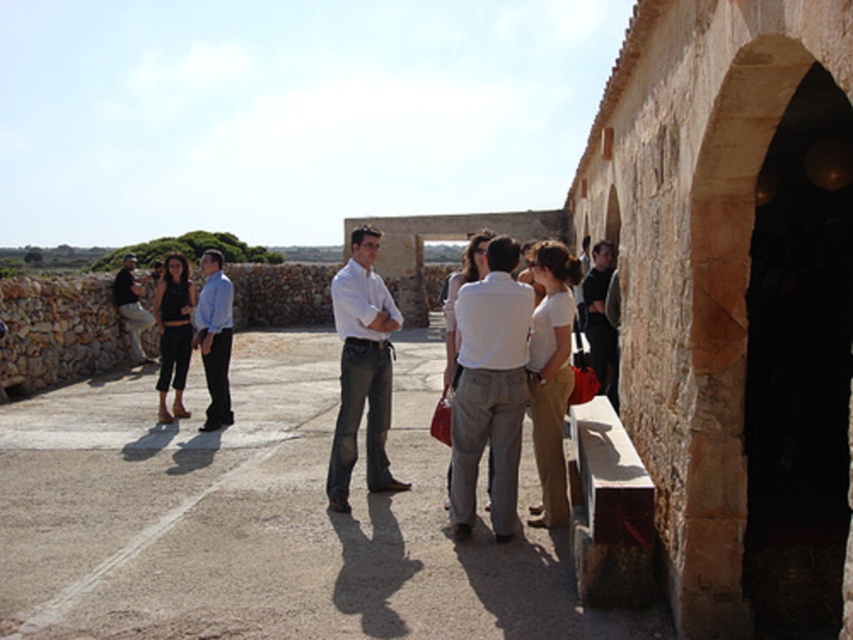
Who is more forward, (498, 506) or (215, 371)?

Point (498, 506)

Does white cotton shirt at center appear over matte blue shirt at center?

No, white cotton shirt at center is not above matte blue shirt at center.

Which is in front, point (514, 532) or point (202, 429)?

Point (514, 532) is in front.

The image size is (853, 640). Identify the location of white cotton shirt at center. (489, 388).

Does matte white shirt at center appear over matte black shirt at left?

No, matte white shirt at center is not above matte black shirt at left.

Find the location of a particular element. matte white shirt at center is located at coordinates (363, 369).

The width and height of the screenshot is (853, 640). Find the location of `matte white shirt at center`. matte white shirt at center is located at coordinates (363, 369).

Identify the location of matte white shirt at center. This screenshot has width=853, height=640. (363, 369).

From the picture: Who is shorter, white cotton shirt at center or matte black shirt at left?

Standing shorter between the two is white cotton shirt at center.

Is white cotton shirt at center shorter than matte black shirt at left?

Correct, white cotton shirt at center is not as tall as matte black shirt at left.

Which is behind, point (491, 481) or point (125, 259)?

Point (125, 259)

Image resolution: width=853 pixels, height=640 pixels. In order to click on white cotton shirt at center in this screenshot , I will do (x=489, y=388).